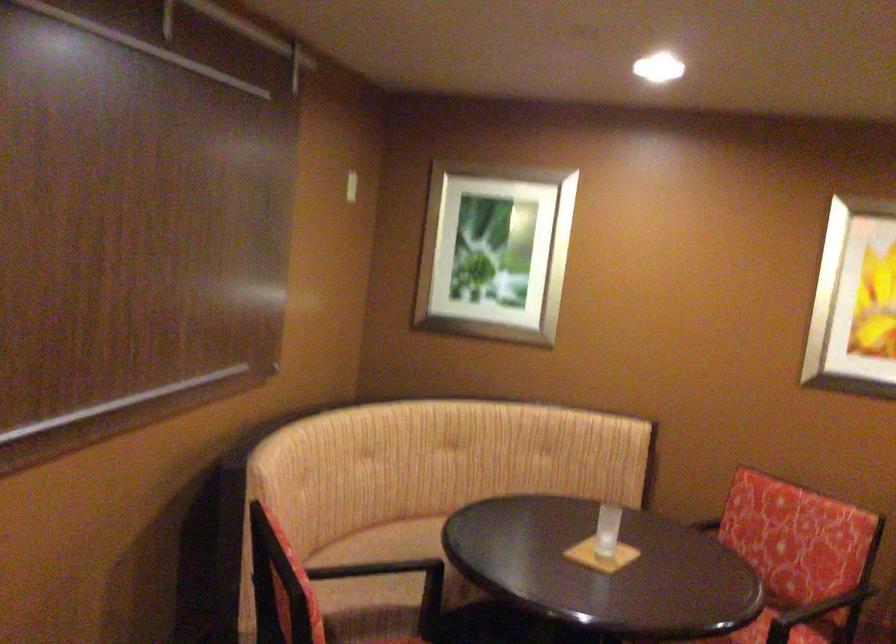
What are the coordinates of `red chair sitting surface` in the screenshot? It's located at (779, 630).